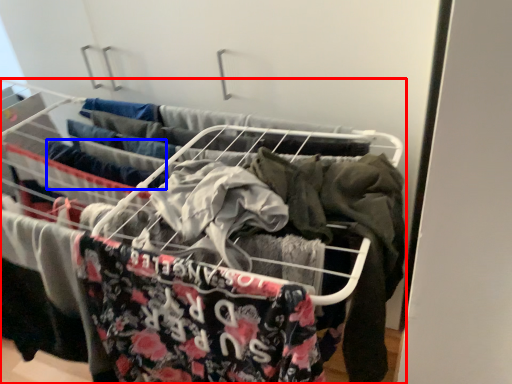
Question: Among these objects, which one is farthest to the camera, furniture (highlighted by a red box) or clothing (highlighted by a blue box)?

Choices:
 (A) furniture
 (B) clothing

Answer: (B)